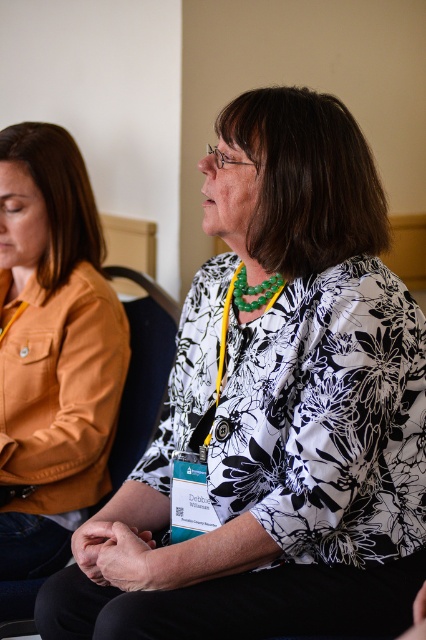
Question: Considering the relative positions of matte orange jacket at left and black fabric chair at center in the image provided, where is matte orange jacket at left located with respect to black fabric chair at center?

Choices:
 (A) above
 (B) below

Answer: (A)

Question: Does matte orange jacket at left appear under black fabric chair at center?

Choices:
 (A) yes
 (B) no

Answer: (B)

Question: Which of the following is the farthest from the observer?

Choices:
 (A) black fabric chair at center
 (B) matte orange jacket at left

Answer: (B)

Question: Can you confirm if matte orange jacket at left is thinner than black fabric chair at center?

Choices:
 (A) yes
 (B) no

Answer: (A)